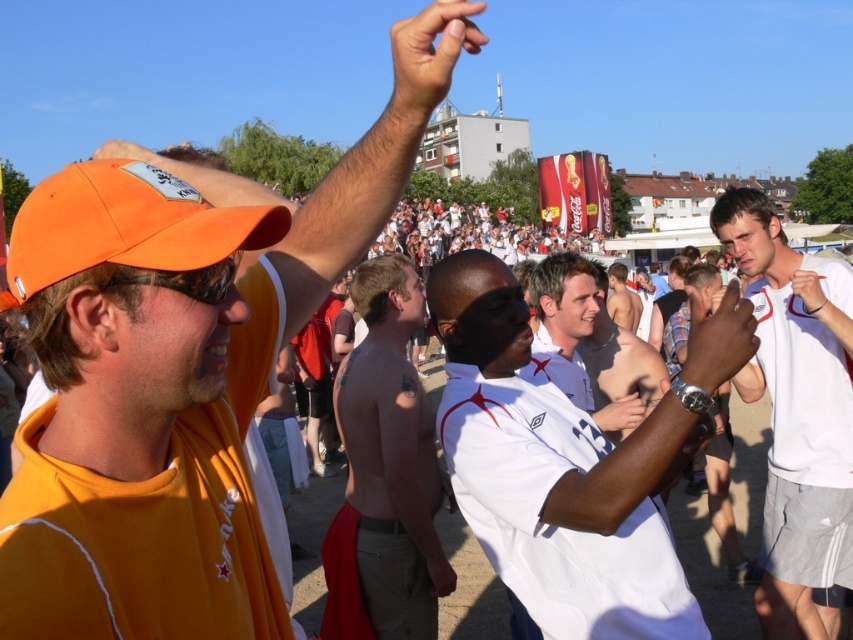
Question: Can you confirm if orange matte cap at upper left is thinner than matte orange baseball cap at upper left?

Choices:
 (A) no
 (B) yes

Answer: (A)

Question: Which of the following is the farthest from the observer?

Choices:
 (A) orange matte cap at upper left
 (B) matte orange cap at upper center
 (C) white smooth shirt at center

Answer: (C)

Question: Among these objects, which one is nearest to the camera?

Choices:
 (A) matte orange cap at upper center
 (B) matte black hand at center

Answer: (A)

Question: Is orange matte cap at upper left to the left of matte orange baseball cap at upper left from the viewer's perspective?

Choices:
 (A) no
 (B) yes

Answer: (A)

Question: Estimate the real-world distances between objects in this image. Which object is closer to the matte white shirt at center?

Choices:
 (A) matte orange baseball cap at upper left
 (B) white matte shirt at center
 (C) matte orange cap at upper center

Answer: (B)

Question: Observing the image, what is the correct spatial positioning of white matte shirt at center in reference to matte orange cap at upper center?

Choices:
 (A) right
 (B) left

Answer: (A)